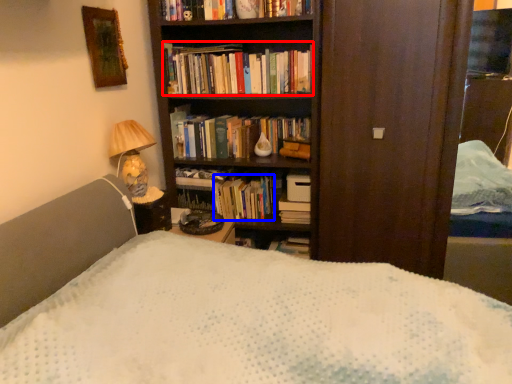
Question: Among these objects, which one is farthest to the camera, book (highlighted by a red box) or book (highlighted by a blue box)?

Choices:
 (A) book
 (B) book

Answer: (B)